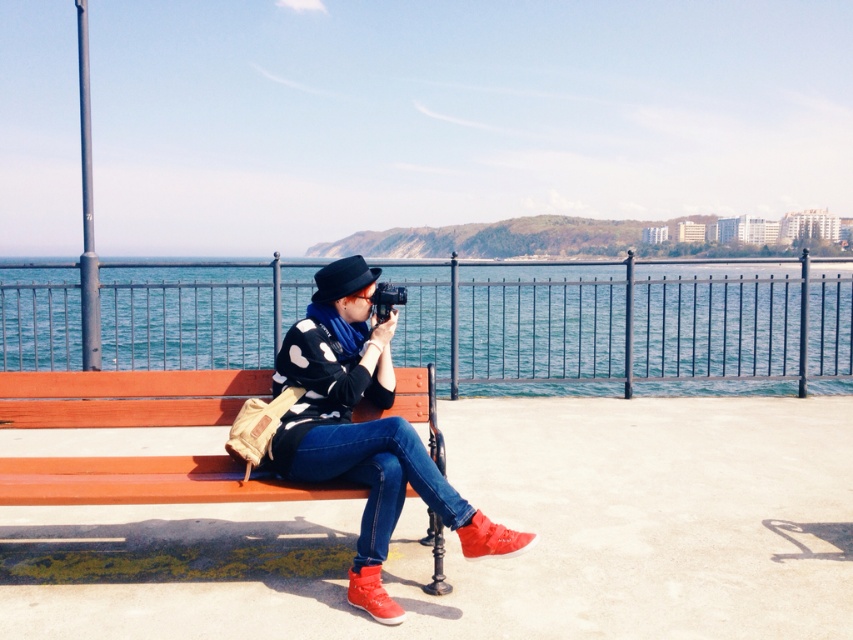
Question: Does blue water at center appear on the left side of wooden bench at center?

Choices:
 (A) yes
 (B) no

Answer: (B)

Question: Does blue water at center appear on the left side of polka dot sweater at center?

Choices:
 (A) no
 (B) yes

Answer: (B)

Question: Which of the following is the farthest from the observer?

Choices:
 (A) (200, 307)
 (B) (91, 400)

Answer: (A)

Question: Can you confirm if blue water at center is positioned below wooden bench at center?

Choices:
 (A) yes
 (B) no

Answer: (B)

Question: Based on their relative distances, which object is farther from the wooden bench at center?

Choices:
 (A) polka dot sweater at center
 (B) blue water at center

Answer: (B)

Question: Which object is positioned farthest from the polka dot sweater at center?

Choices:
 (A) blue water at center
 (B) wooden bench at center

Answer: (A)